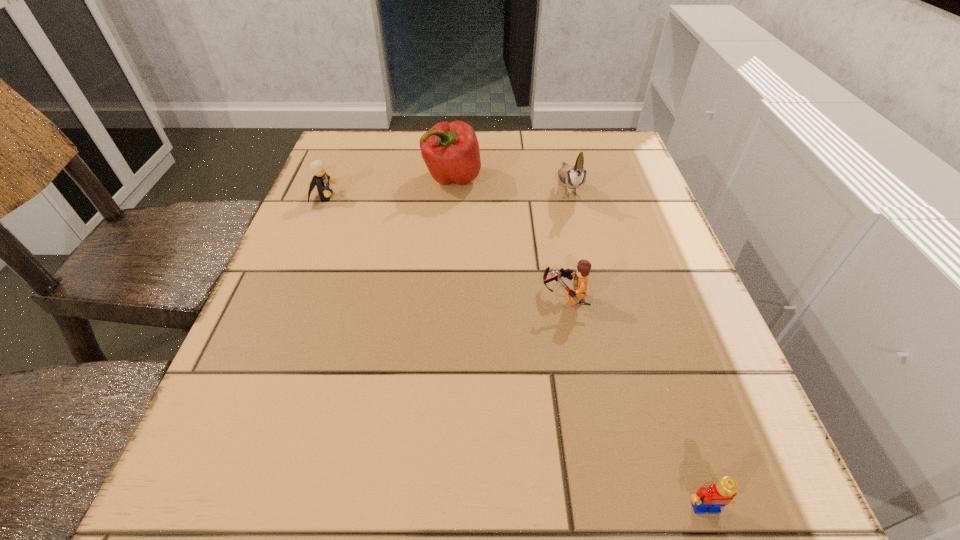
Image resolution: width=960 pixels, height=540 pixels. I want to click on free space located holding a crossbow in the hands of the second farthest Lego, so click(362, 296).

You are a GUI agent. You are given a task and a screenshot of the screen. Output one action in this format:
    pyautogui.click(x=<x>, y=<y>)
    Task: Click on the blank space located 0.120m holding a crossbow in the hands of the second farthest Lego
    
    Given the screenshot: What is the action you would take?
    pyautogui.click(x=474, y=296)

This screenshot has width=960, height=540. Identify the location of free point located holding a crossbow in the hands of the second farthest Lego. (346, 296).

At what (x,y) coordinates should I click in order to perform the action: click on blank area located 0.280m on the front-facing side of the farthest Lego. Please return your answer as a coordinate pair (x, y). This screenshot has width=960, height=540. Looking at the image, I should click on (461, 197).

Where is `bell pepper that is at the far edge`? bell pepper that is at the far edge is located at coordinates (450, 150).

Locate an element on the screen. bird that is at the far edge is located at coordinates (573, 177).

At what (x,y) coordinates should I click in order to perform the action: click on object present at the near edge. Please return your answer as a coordinate pair (x, y). This screenshot has height=540, width=960. Looking at the image, I should click on (711, 499).

Where is `object that is positioned at the left edge`? The image size is (960, 540). object that is positioned at the left edge is located at coordinates (320, 179).

Image resolution: width=960 pixels, height=540 pixels. I want to click on bird that is positioned at the right edge, so click(x=573, y=177).

Find the location of a particular element. Lego situated at the right edge is located at coordinates (711, 499).